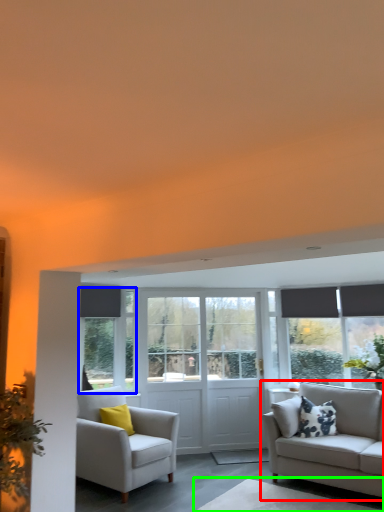
Question: Which object is the farthest from studio couch (highlighted by a red box)? Choose among these: window (highlighted by a blue box) or table (highlighted by a green box).

Choices:
 (A) window
 (B) table

Answer: (A)